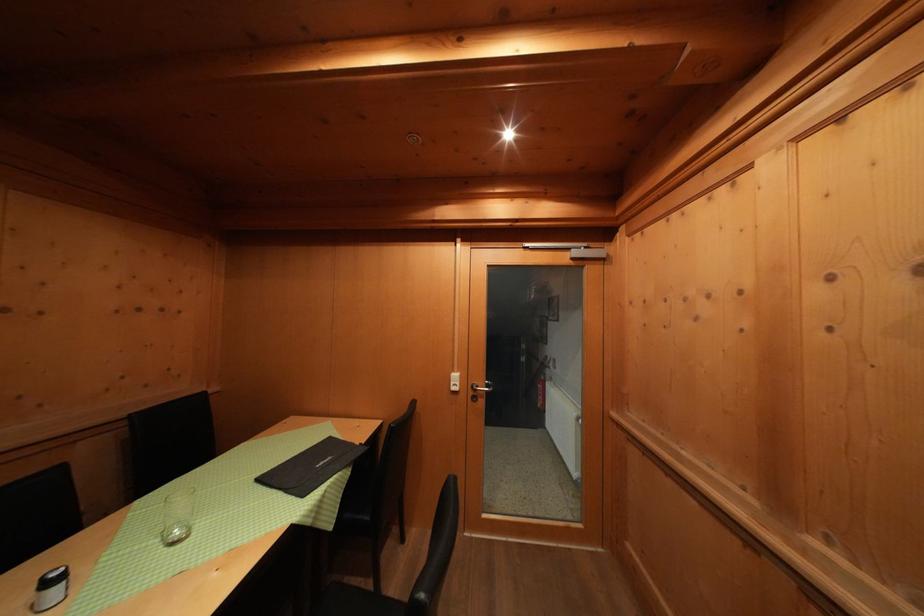
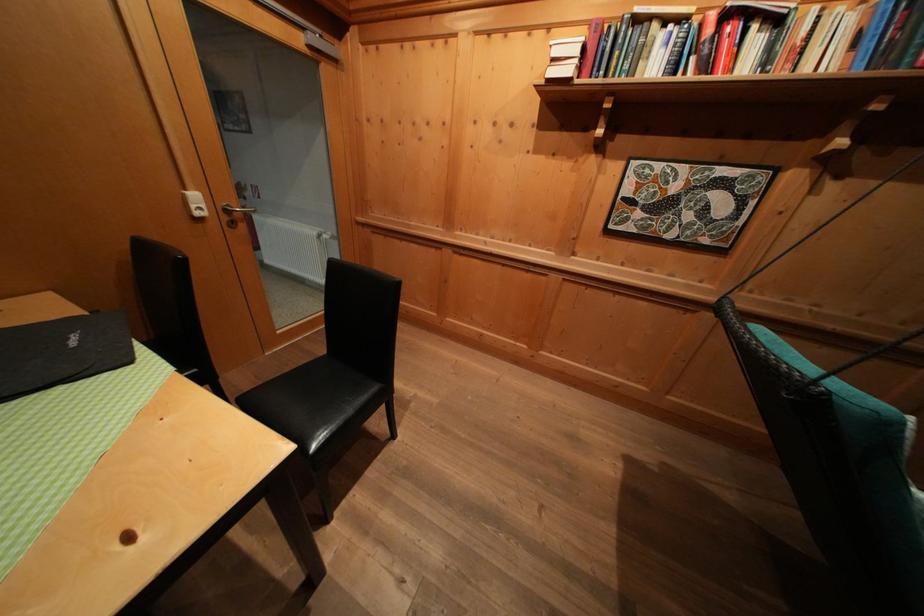
The images are taken continuously from a first-person perspective. In which direction is your viewpoint rotating?

The camera's rotation is toward right-down.